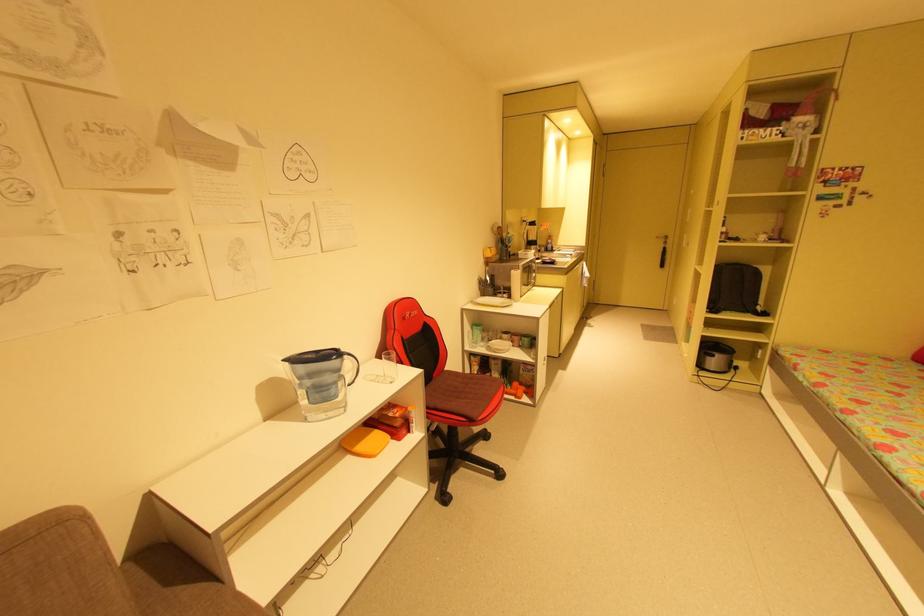
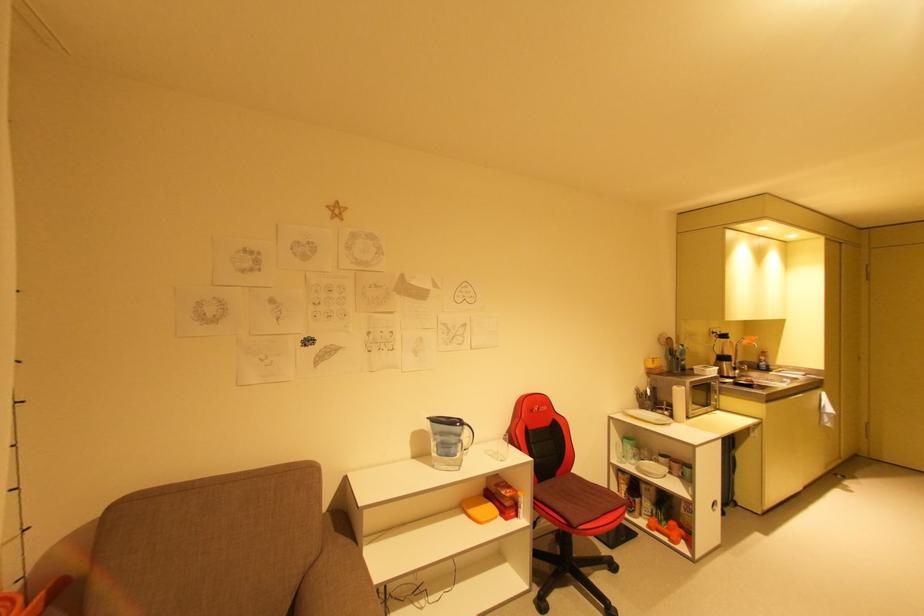
Where in the second image is the point corresponding to point 530,283 from the first image?

(708, 403)